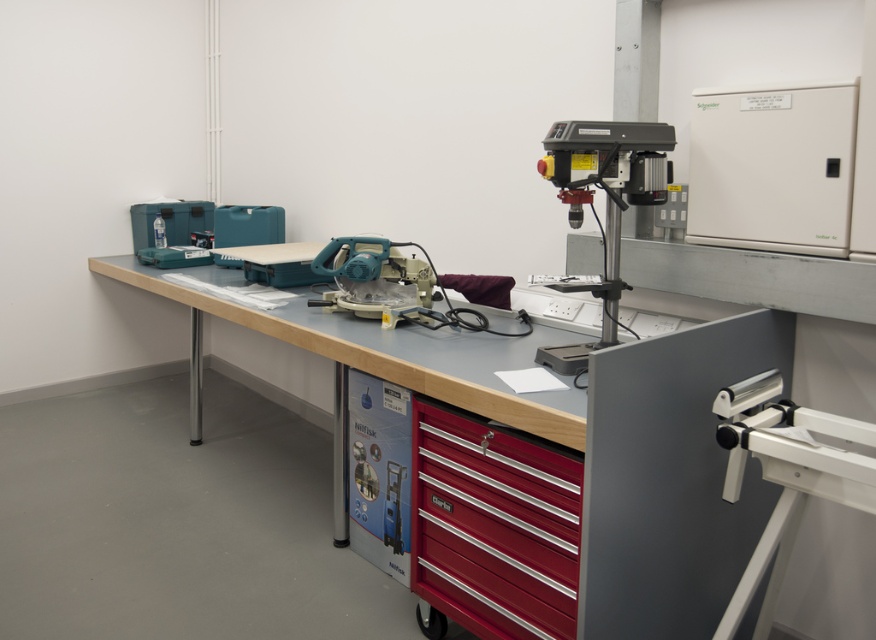
Who is lower down, metallic gray table at center or matte plastic circular saw at center?

metallic gray table at center is below.

Is metallic gray table at center shorter than matte plastic circular saw at center?

Incorrect, metallic gray table at center's height does not fall short of matte plastic circular saw at center's.

Between point (512, 416) and point (419, 289), which one is positioned behind?

Positioned behind is point (419, 289).

The width and height of the screenshot is (876, 640). Identify the location of metallic gray table at center. (376, 364).

Does red metallic drawer at center have a greater width compared to metallic gray table at center?

No.

Which of these two, red metallic drawer at center or metallic gray table at center, stands shorter?

red metallic drawer at center

Where is `red metallic drawer at center`? red metallic drawer at center is located at coordinates (493, 525).

Describe the element at coordinates (493, 525) in the screenshot. I see `red metallic drawer at center` at that location.

Image resolution: width=876 pixels, height=640 pixels. Find the location of `red metallic drawer at center`. red metallic drawer at center is located at coordinates (493, 525).

The image size is (876, 640). Find the location of `red metallic drawer at center`. red metallic drawer at center is located at coordinates [493, 525].